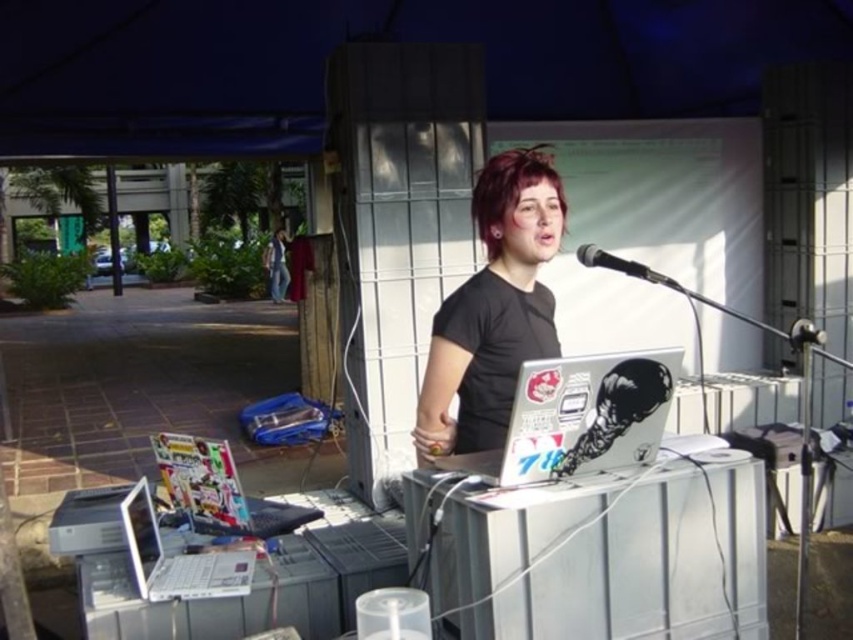
Question: Does black matte t-shirt at center have a greater width compared to metallic silver microphone at right?

Choices:
 (A) no
 (B) yes

Answer: (B)

Question: Which point appears closest to the camera in this image?

Choices:
 (A) (656, 275)
 (B) (218, 550)
 (C) (482, 344)

Answer: (A)

Question: Which of the following is the closest to the observer?

Choices:
 (A) (201, 493)
 (B) (637, 273)
 (C) (807, 340)

Answer: (C)

Question: Does black matte t-shirt at center appear under sticker-covered silver laptop at center?

Choices:
 (A) no
 (B) yes

Answer: (A)

Question: Considering the real-world distances, which object is farthest from the metallic silver microphone at right?

Choices:
 (A) black metallic microphone at upper right
 (B) silver metallic laptop at lower left

Answer: (B)

Question: Does shiny plastic laptop at lower left have a greater width compared to black metallic microphone at upper right?

Choices:
 (A) no
 (B) yes

Answer: (B)